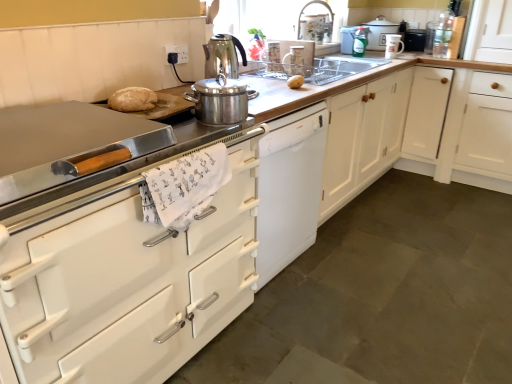
Find the location of `free space above black matte microwave at upper right, the first appliance positioned from the back (from a real-world perspective)`. free space above black matte microwave at upper right, the first appliance positioned from the back (from a real-world perspective) is located at coordinates (419, 24).